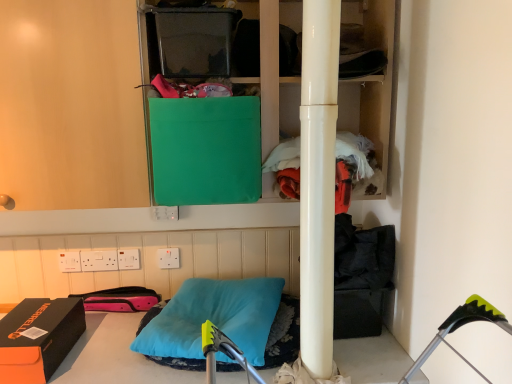
What is the approximate width of orange fleece jacket at center right?

It is 9.25 inches.

Where is `orange fleece jacket at center right`? The height and width of the screenshot is (384, 512). orange fleece jacket at center right is located at coordinates (356, 155).

In order to face white plastic electric outlet at lower center, acting as the second electric outlet starting from the left, should I rotate leftwards or rightwards?

You should look left and rotate roughly 20.117 degrees.

This screenshot has width=512, height=384. What do you see at coordinates (99, 261) in the screenshot? I see `white plastic electric outlet at lower center, the fourth electric outlet when ordered from right to left` at bounding box center [99, 261].

Locate an element on the screen. The image size is (512, 384). orange matte shoebox at lower left, marked as the first box in a left-to-right arrangement is located at coordinates (39, 338).

The image size is (512, 384). What do you see at coordinates (69, 261) in the screenshot?
I see `white plastic electric outlet at lower center, placed as the 1th electric outlet when sorted from left to right` at bounding box center [69, 261].

The width and height of the screenshot is (512, 384). What are the coordinates of `orange fleece jacket at center right` in the screenshot? It's located at [356, 155].

Considering the relative sizes of teal soft pillow at center and transparent plastic container at upper center, which is the third box from bottom to top, in the image provided, is teal soft pillow at center shorter than transparent plastic container at upper center, which is the third box from bottom to top,?

Yes, teal soft pillow at center is shorter than transparent plastic container at upper center, which is the third box from bottom to top.

Is teal soft pillow at center at the right side of transparent plastic container at upper center, placed as the second box when sorted from right to left?

Yes, teal soft pillow at center is to the right of transparent plastic container at upper center, placed as the second box when sorted from right to left.

In terms of width, does teal soft pillow at center look wider or thinner when compared to transparent plastic container at upper center, the second box from the left?

teal soft pillow at center is wider than transparent plastic container at upper center, the second box from the left.

From the image's perspective, between teal soft pillow at center and transparent plastic container at upper center, placed as the second box when sorted from right to left, who is located below?

From the image's view, teal soft pillow at center is below.

From a real-world perspective, which is physically above, orange fleece jacket at center right or white plastic electric outlet at upper center, which is the third electric outlet from left to right?

In real-world perspective, orange fleece jacket at center right is above.

Find the location of a particular element. The width and height of the screenshot is (512, 384). clothing located on the right of white plastic electric outlet at upper center, the 3th electric outlet in the right-to-left sequence is located at coordinates (356, 155).

Considering the relative sizes of orange fleece jacket at center right and white plastic electric outlet at upper center, which is the third electric outlet from left to right, in the image provided, is orange fleece jacket at center right wider than white plastic electric outlet at upper center, which is the third electric outlet from left to right,?

Yes, orange fleece jacket at center right is wider than white plastic electric outlet at upper center, which is the third electric outlet from left to right.

Is orange fleece jacket at center right not within white plastic electric outlet at upper center, which is the third electric outlet from left to right?

Yes, orange fleece jacket at center right is located beyond the bounds of white plastic electric outlet at upper center, which is the third electric outlet from left to right.

Could white plastic electric outlet at lower center, placed as the fifth electric outlet when sorted from right to left, be considered to be inside white plastic electric outlet at lower center, which is the 5th electric outlet in left-to-right order?

No, white plastic electric outlet at lower center, which is the 5th electric outlet in left-to-right order, does not contain white plastic electric outlet at lower center, placed as the fifth electric outlet when sorted from right to left.

Is the position of white plastic electric outlet at lower center, placed as the 1th electric outlet when sorted from right to left, more distant than that of white plastic electric outlet at lower center, placed as the fifth electric outlet when sorted from right to left?

Yes, white plastic electric outlet at lower center, placed as the 1th electric outlet when sorted from right to left, is behind white plastic electric outlet at lower center, placed as the fifth electric outlet when sorted from right to left.

Is point (166, 265) positioned after point (62, 266)?

Yes, point (166, 265) is farther from viewer.

From the image's perspective, would you say white plastic electric outlet at lower center, placed as the 1th electric outlet when sorted from right to left, is positioned over white plastic electric outlet at lower center, placed as the fifth electric outlet when sorted from right to left?

Yes.

Which is behind, point (99, 270) or point (178, 217)?

The point (99, 270) is more distant.

Could you tell me if white plastic electric outlet at lower center, acting as the second electric outlet starting from the left, is turned towards white plastic electric outlet at center, the fourth electric outlet from the left?

No, white plastic electric outlet at lower center, acting as the second electric outlet starting from the left, is not oriented towards white plastic electric outlet at center, the fourth electric outlet from the left.

Which is correct: white plastic electric outlet at lower center, the fourth electric outlet when ordered from right to left, is inside white plastic electric outlet at center, the fourth electric outlet from the left, or outside of it?

white plastic electric outlet at lower center, the fourth electric outlet when ordered from right to left, is outside white plastic electric outlet at center, the fourth electric outlet from the left.

Based on the photo, is white plastic electric outlet at lower center, the fourth electric outlet when ordered from right to left, situated inside white plastic electric outlet at lower center, placed as the 1th electric outlet when sorted from left to right, or outside?

white plastic electric outlet at lower center, the fourth electric outlet when ordered from right to left, cannot be found inside white plastic electric outlet at lower center, placed as the 1th electric outlet when sorted from left to right.

From a real-world perspective, is white plastic electric outlet at lower center, acting as the second electric outlet starting from the left, physically above white plastic electric outlet at lower center, placed as the fifth electric outlet when sorted from right to left?

Actually, white plastic electric outlet at lower center, acting as the second electric outlet starting from the left, is physically below white plastic electric outlet at lower center, placed as the fifth electric outlet when sorted from right to left, in the real world.

How different are the orientations of white plastic electric outlet at lower center, acting as the second electric outlet starting from the left, and white plastic electric outlet at lower center, placed as the 1th electric outlet when sorted from left to right, in degrees?

white plastic electric outlet at lower center, acting as the second electric outlet starting from the left, and white plastic electric outlet at lower center, placed as the 1th electric outlet when sorted from left to right, are facing 1.51 degrees away from each other.

Considering the relative sizes of green fabric bag at upper center and white plastic electric outlet at lower center, placed as the fifth electric outlet when sorted from right to left, in the image provided, is green fabric bag at upper center shorter than white plastic electric outlet at lower center, placed as the fifth electric outlet when sorted from right to left,?

Incorrect, the height of green fabric bag at upper center does not fall short of that of white plastic electric outlet at lower center, placed as the fifth electric outlet when sorted from right to left.

Could you tell me if green fabric bag at upper center is turned towards white plastic electric outlet at lower center, placed as the 1th electric outlet when sorted from left to right?

No, green fabric bag at upper center is not oriented towards white plastic electric outlet at lower center, placed as the 1th electric outlet when sorted from left to right.

Is green fabric bag at upper center positioned behind white plastic electric outlet at lower center, placed as the fifth electric outlet when sorted from right to left?

No, it is in front of white plastic electric outlet at lower center, placed as the fifth electric outlet when sorted from right to left.

Does green fabric bag at upper center have a larger size compared to white plastic electric outlet at lower center, placed as the fifth electric outlet when sorted from right to left?

Yes.

I want to click on pillow on the left of the orange fleece jacket at center right, so click(x=213, y=317).

Which of these two, teal soft pillow at center or orange fleece jacket at center right, is smaller?

orange fleece jacket at center right.

Is teal soft pillow at center closer to camera compared to orange fleece jacket at center right?

Yes, it is.

From the picture: Can you tell me how much teal soft pillow at center and orange fleece jacket at center right differ in facing direction?

They differ by 14.8 degrees in their facing directions.

Starting from the teal soft pillow at center, which box is the 2nd one to the left? Please provide its 2D coordinates.

[(195, 41)]

From a real-world perspective, count 4th electric outlets downward from the orange fleece jacket at center right and point to it. Please provide its 2D coordinates.

[(129, 259)]

Consider the image. Which object lies nearer to the anchor point orange matte shoebox at lower left, marked as the 3th box in a top-to-bottom arrangement, transparent plastic container at upper center, the 1th box from the top, or white plastic electric outlet at center, the fourth electric outlet from the left?

The object closer to orange matte shoebox at lower left, marked as the 3th box in a top-to-bottom arrangement, is white plastic electric outlet at center, the fourth electric outlet from the left.

From the image, which object appears to be nearer to orange matte shoebox at lower left, positioned as the 3th box in right-to-left order, green fabric bag at upper center or transparent plastic container at upper center, which is the third box from bottom to top?

transparent plastic container at upper center, which is the third box from bottom to top.

Which object lies further to the anchor point glossy white pole at center, orange matte shoebox at lower left, marked as the 3th box in a top-to-bottom arrangement, or white plastic electric outlet at lower center, acting as the second electric outlet starting from the left?

white plastic electric outlet at lower center, acting as the second electric outlet starting from the left, lies further to glossy white pole at center than the other object.

Which object lies nearer to the anchor point transparent plastic container at upper center, the 1th box from the top, glossy white pole at center or white plastic electric outlet at lower center, placed as the 1th electric outlet when sorted from right to left?

glossy white pole at center is closer to transparent plastic container at upper center, the 1th box from the top.

Considering their positions, is orange matte shoebox at lower left, which is counted as the 1th box, starting from the bottom, positioned further to white plastic electric outlet at upper center, which is the third electric outlet from left to right, than white plastic electric outlet at lower center, the fourth electric outlet when ordered from right to left?

orange matte shoebox at lower left, which is counted as the 1th box, starting from the bottom, is positioned further to the anchor white plastic electric outlet at upper center, which is the third electric outlet from left to right.

Which object lies further to the anchor point green fabric bag at upper center, white plastic electric outlet at lower center, acting as the second electric outlet starting from the left, or teal soft pillow at center?

Based on the image, white plastic electric outlet at lower center, acting as the second electric outlet starting from the left, appears to be further to green fabric bag at upper center.

When comparing their distances from white plastic electric outlet at center, the fourth electric outlet from the left, does teal soft pillow at center or white plastic electric outlet at lower center, which is the 5th electric outlet in left-to-right order, seem further?

Based on the image, teal soft pillow at center appears to be further to white plastic electric outlet at center, the fourth electric outlet from the left.

From the image, which object appears to be nearer to teal soft pillow at center, white plastic electric outlet at upper center, which is the third electric outlet from left to right, or transparent plastic container at upper center, which is the third box from bottom to top?

white plastic electric outlet at upper center, which is the third electric outlet from left to right, lies closer to teal soft pillow at center than the other object.

Where is `pillow located between white plastic electric outlet at lower center, acting as the second electric outlet starting from the left, and glossy white pole at center in the left-right direction`? pillow located between white plastic electric outlet at lower center, acting as the second electric outlet starting from the left, and glossy white pole at center in the left-right direction is located at coordinates (213, 317).

This screenshot has height=384, width=512. I want to click on beam located between white plastic electric outlet at lower center, placed as the 1th electric outlet when sorted from left to right, and orange fleece jacket at center right in the left-right direction, so click(318, 182).

Where is `clothing located between glossy white pole at center and white plastic electric outlet at lower center, placed as the 1th electric outlet when sorted from right to left, in the depth direction`? The image size is (512, 384). clothing located between glossy white pole at center and white plastic electric outlet at lower center, placed as the 1th electric outlet when sorted from right to left, in the depth direction is located at coordinates (356, 155).

Locate an element on the screen. This screenshot has height=384, width=512. clothing between transparent plastic container at upper center, the second box from the left, and white plastic electric outlet at upper center, the 3th electric outlet in the right-to-left sequence, from top to bottom is located at coordinates (356, 155).